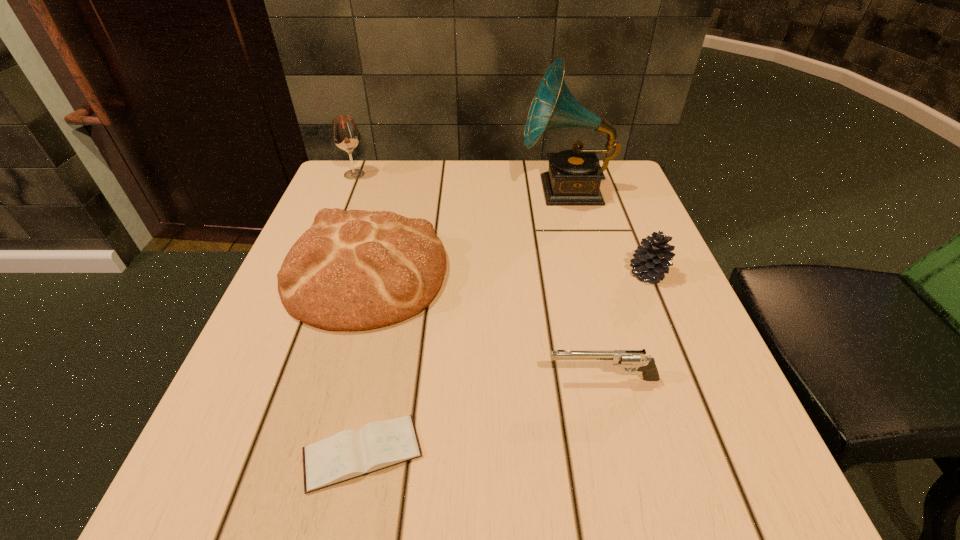
This screenshot has width=960, height=540. In order to click on phonograph_record in this screenshot , I will do `click(574, 176)`.

Image resolution: width=960 pixels, height=540 pixels. What are the coordinates of `the second tallest object` in the screenshot? It's located at (345, 134).

Where is `the third tallest object`? The height and width of the screenshot is (540, 960). the third tallest object is located at coordinates (353, 270).

At what (x,y) coordinates should I click in order to perform the action: click on the fourth tallest object. Please return your answer as a coordinate pair (x, y). Image resolution: width=960 pixels, height=540 pixels. Looking at the image, I should click on (652, 261).

At what (x,y) coordinates should I click in order to perform the action: click on pistol. Please return your answer as a coordinate pair (x, y). The width and height of the screenshot is (960, 540). Looking at the image, I should click on (646, 364).

Locate an element on the screen. The height and width of the screenshot is (540, 960). the fifth tallest object is located at coordinates (646, 364).

Identify the location of the nearest object. (349, 454).

The height and width of the screenshot is (540, 960). I want to click on diary, so click(349, 454).

In order to click on vacant area situated 0.380m from the horn of the phonograph_record in this screenshot , I will do `click(365, 190)`.

In order to click on free space located from the horn of the phonograph_record in this screenshot , I will do `click(434, 190)`.